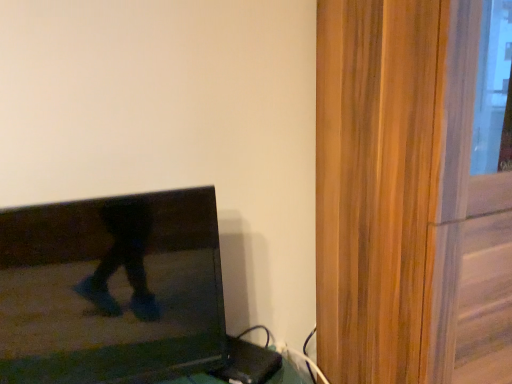
Question: Is matte black tv at left completely or partially inside wooden screen door at right?

Choices:
 (A) no
 (B) yes

Answer: (A)

Question: Is the position of wooden screen door at right less distant than that of matte black tv at left?

Choices:
 (A) no
 (B) yes

Answer: (B)

Question: Is wooden screen door at right placed right next to matte black tv at left?

Choices:
 (A) no
 (B) yes

Answer: (A)

Question: Could you tell me if wooden screen door at right is facing matte black tv at left?

Choices:
 (A) no
 (B) yes

Answer: (A)

Question: Is matte black tv at left at the back of wooden screen door at right?

Choices:
 (A) yes
 (B) no

Answer: (B)

Question: From a real-world perspective, is wooden screen door at right beneath matte black tv at left?

Choices:
 (A) no
 (B) yes

Answer: (A)

Question: Is wooden screen door at right located within matte black tv at left?

Choices:
 (A) no
 (B) yes

Answer: (A)

Question: From the image's perspective, is matte black tv at left on top of wooden screen door at right?

Choices:
 (A) yes
 (B) no

Answer: (B)

Question: Is matte black tv at left outside of wooden screen door at right?

Choices:
 (A) yes
 (B) no

Answer: (A)

Question: From the image's perspective, is matte black tv at left below wooden screen door at right?

Choices:
 (A) no
 (B) yes

Answer: (B)

Question: Does matte black tv at left have a greater width compared to wooden screen door at right?

Choices:
 (A) yes
 (B) no

Answer: (B)

Question: Considering the relative positions of matte black tv at left and wooden screen door at right in the image provided, is matte black tv at left to the right of wooden screen door at right from the viewer's perspective?

Choices:
 (A) no
 (B) yes

Answer: (A)

Question: Considering the positions of wooden screen door at right and matte black tv at left in the image, is wooden screen door at right bigger or smaller than matte black tv at left?

Choices:
 (A) big
 (B) small

Answer: (A)